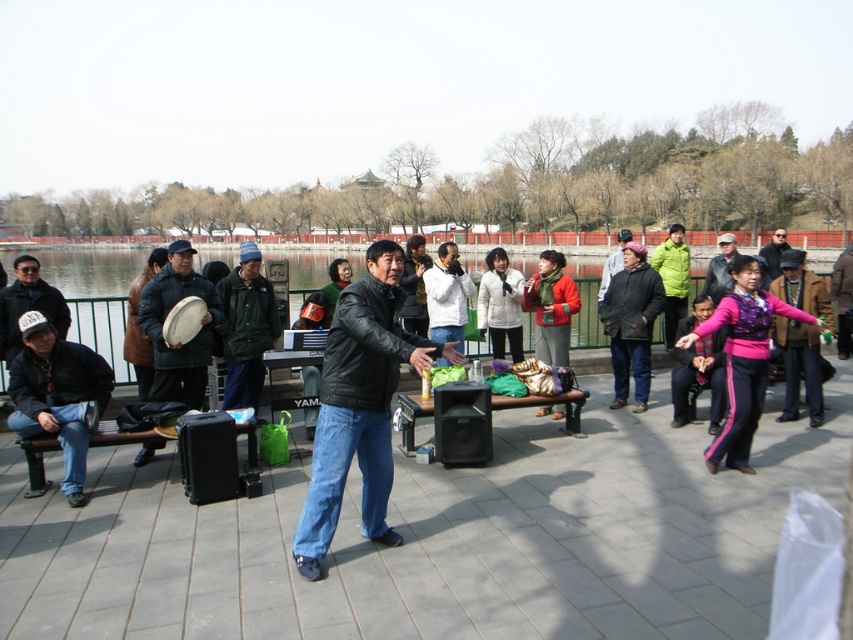
Is matte black jacket at left thinner than matte black drum at left?

Indeed, matte black jacket at left has a lesser width compared to matte black drum at left.

In the scene shown: Does matte black jacket at left have a smaller size compared to matte black drum at left?

Correct, matte black jacket at left occupies less space than matte black drum at left.

Is point (42, 339) less distant than point (209, 282)?

Yes, point (42, 339) is closer to viewer.

Find the location of `matte black jacket at left`. matte black jacket at left is located at coordinates (57, 394).

Who is taller, black leather jacket at center or dark gray leather jacket at center?

dark gray leather jacket at center is taller.

Does black leather jacket at center come behind dark gray leather jacket at center?

No, black leather jacket at center is closer to the viewer.

Locate an element on the screen. The image size is (853, 640). black leather jacket at center is located at coordinates (358, 406).

Is green matte jacket at center thinner than dark gray leather jacket at center?

Correct, green matte jacket at center's width is less than dark gray leather jacket at center's.

Between green matte jacket at center and dark gray leather jacket at center, which one has more height?

dark gray leather jacket at center is taller.

Between point (242, 244) and point (778, 260), which one is positioned behind?

Point (778, 260)

This screenshot has width=853, height=640. What are the coordinates of `green matte jacket at center` in the screenshot? It's located at (247, 326).